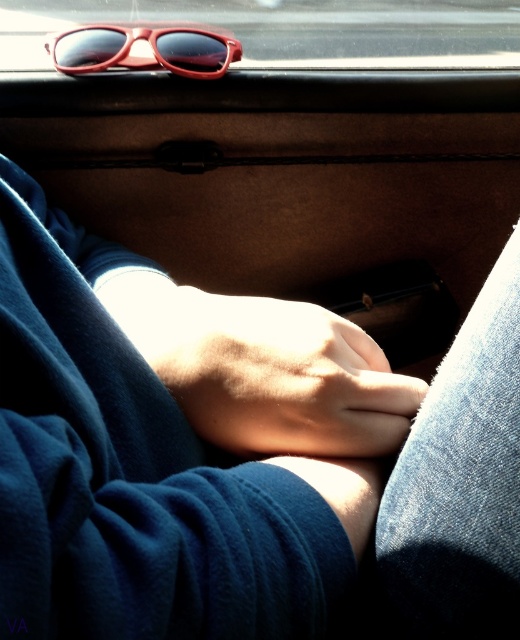
You are a passenger in the car and want to grab the matte plastic sunglasses at upper center from the smooth skin hand at center. Can you reach them without moving your hand?

The smooth skin hand at center has a lesser height compared to the matte plastic sunglasses at upper center, so you cannot reach them without moving your hand.